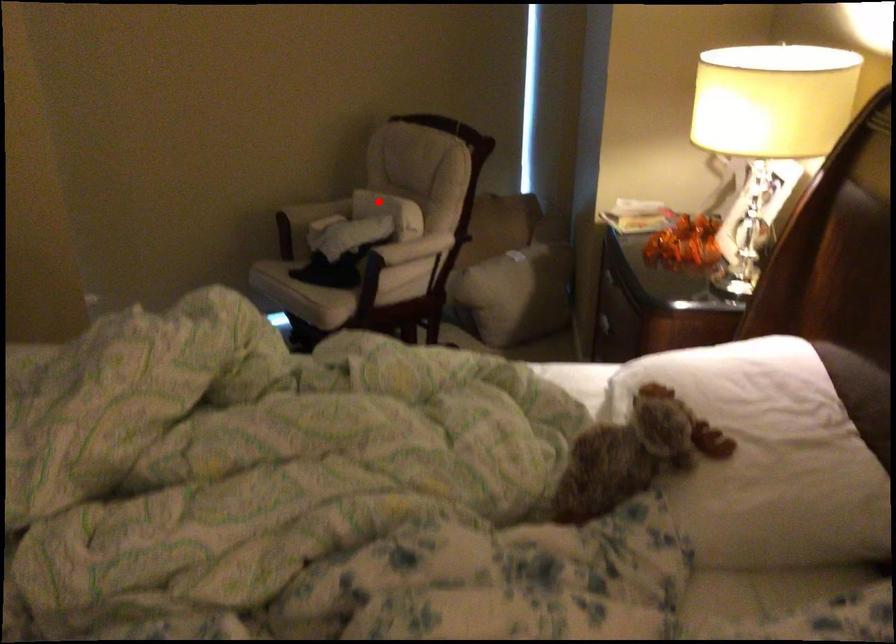
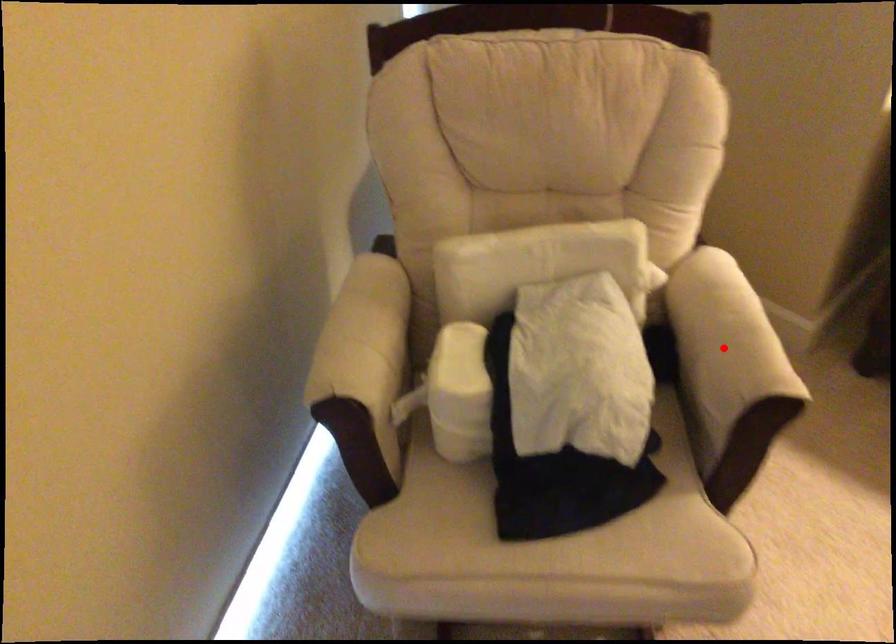
I am providing you with two images of the same scene from different viewpoints. A red point is marked on the first image and another point is marked on the second image. Do the highlighted points in image1 and image2 indicate the same real-world spot?

No